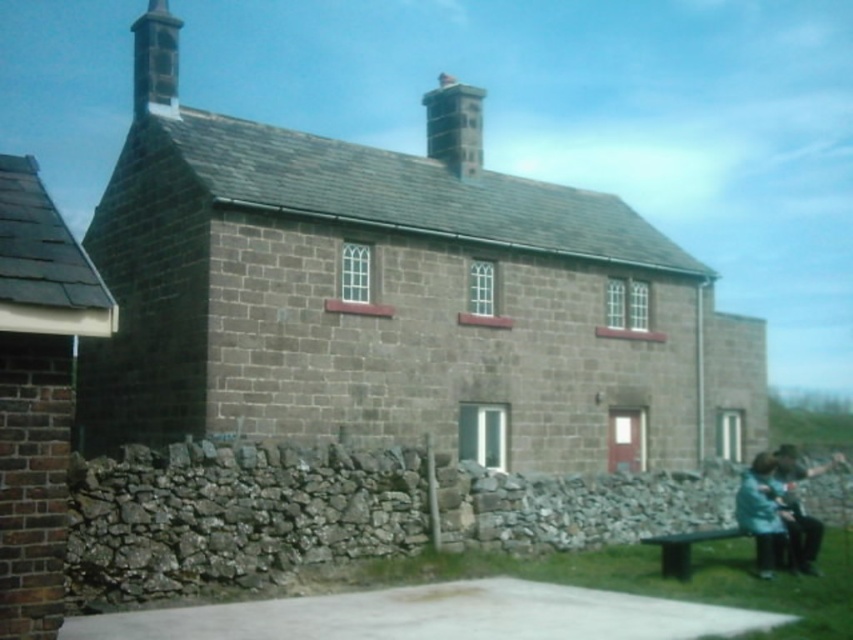
Between smooth stone chimney at upper left and green wooden bench at lower right, which one has less height?

green wooden bench at lower right is shorter.

Does smooth stone chimney at upper left come behind green wooden bench at lower right?

Yes, smooth stone chimney at upper left is behind green wooden bench at lower right.

At what (x,y) coordinates should I click in order to perform the action: click on smooth stone chimney at upper left. Please return your answer as a coordinate pair (x, y). Looking at the image, I should click on (155, 60).

Which of these two, blue-green fabric jacket at lower right or green wooden bench at lower right, stands taller?

blue-green fabric jacket at lower right

Between blue-green fabric jacket at lower right and green wooden bench at lower right, which one is positioned higher?

blue-green fabric jacket at lower right

Image resolution: width=853 pixels, height=640 pixels. Describe the element at coordinates (762, 513) in the screenshot. I see `blue-green fabric jacket at lower right` at that location.

Find the location of a particular element. Image resolution: width=853 pixels, height=640 pixels. blue-green fabric jacket at lower right is located at coordinates (762, 513).

Is smooth stone chimney at upper left wider than blue fabric at lower right?

Yes, smooth stone chimney at upper left is wider than blue fabric at lower right.

Can you confirm if smooth stone chimney at upper left is taller than blue fabric at lower right?

Indeed, smooth stone chimney at upper left has a greater height compared to blue fabric at lower right.

Which is behind, point (165, 60) or point (805, 522)?

Positioned behind is point (165, 60).

The width and height of the screenshot is (853, 640). Find the location of `smooth stone chimney at upper left`. smooth stone chimney at upper left is located at coordinates (155, 60).